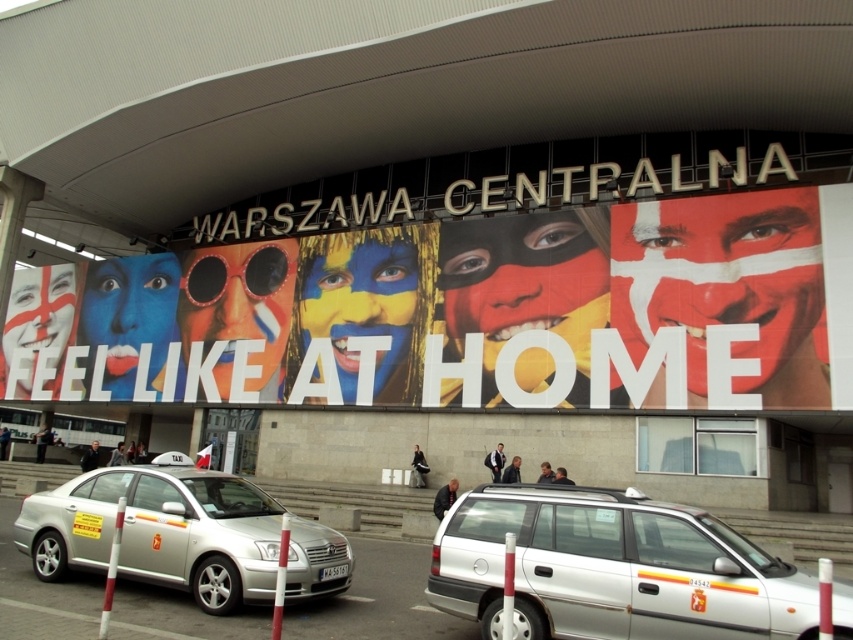
Question: Is the position of multicolored painted faces at center less distant than that of silver metallic station wagon at center?

Choices:
 (A) yes
 (B) no

Answer: (B)

Question: Which point is farther from the camera taking this photo?

Choices:
 (A) (706, 273)
 (B) (253, 566)

Answer: (A)

Question: Which is nearer to the silver metallic station wagon at center?

Choices:
 (A) silver metallic taxi at lower left
 (B) multicolored painted faces at center

Answer: (A)

Question: Is multicolored painted faces at center above silver metallic station wagon at center?

Choices:
 (A) yes
 (B) no

Answer: (A)

Question: Which point is farther to the camera?

Choices:
 (A) multicolored painted faces at center
 (B) silver metallic station wagon at center
 (C) silver metallic taxi at lower left

Answer: (A)

Question: Is silver metallic station wagon at center below silver metallic taxi at lower left?

Choices:
 (A) yes
 (B) no

Answer: (A)